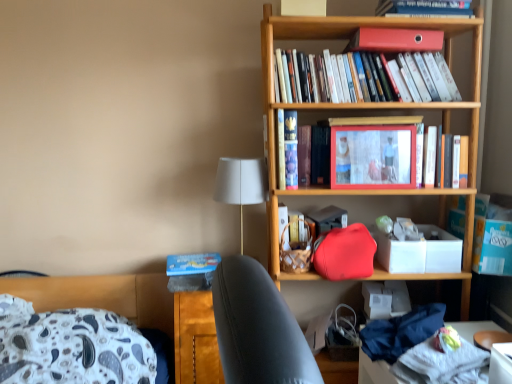
Locate an element on the screen. The image size is (512, 384). vacant space situated above blue matte paperback book at lower left, which ranks as the 2th paperback book in front-to-back order (from a real-world perspective) is located at coordinates (189, 260).